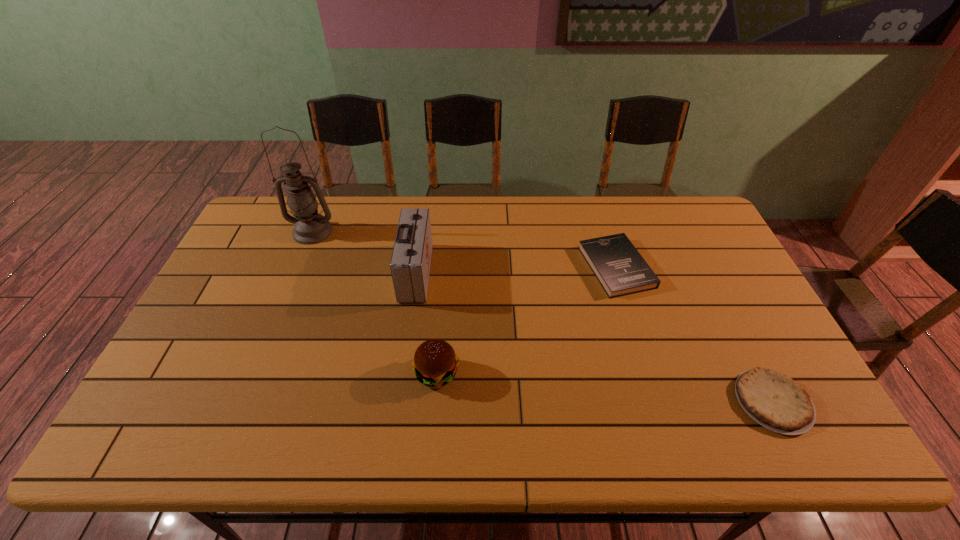
Identify the location of vacant space located on the left of the third tallest object. The height and width of the screenshot is (540, 960). (359, 374).

Identify the location of vacant space situated 0.200m on the right of the book. The height and width of the screenshot is (540, 960). (713, 267).

Image resolution: width=960 pixels, height=540 pixels. I want to click on vacant space located 0.210m on the back of the tortilla, so click(x=726, y=308).

Find the location of `object that is at the far edge`. object that is at the far edge is located at coordinates (310, 227).

You are a GUI agent. You are given a task and a screenshot of the screen. Output one action in this format:
    pyautogui.click(x=<x>, y=<y>)
    Task: Click on the object situated at the near edge
    
    Given the screenshot: What is the action you would take?
    pyautogui.click(x=774, y=400)

Image resolution: width=960 pixels, height=540 pixels. I want to click on object that is at the left edge, so click(310, 227).

The height and width of the screenshot is (540, 960). What are the coordinates of `object located at the right edge` in the screenshot? It's located at (774, 400).

The image size is (960, 540). Find the location of `object that is at the far left corner`. object that is at the far left corner is located at coordinates (310, 227).

Locate an element on the screen. The height and width of the screenshot is (540, 960). object at the near right corner is located at coordinates (774, 400).

I want to click on vacant area at the far edge, so click(450, 210).